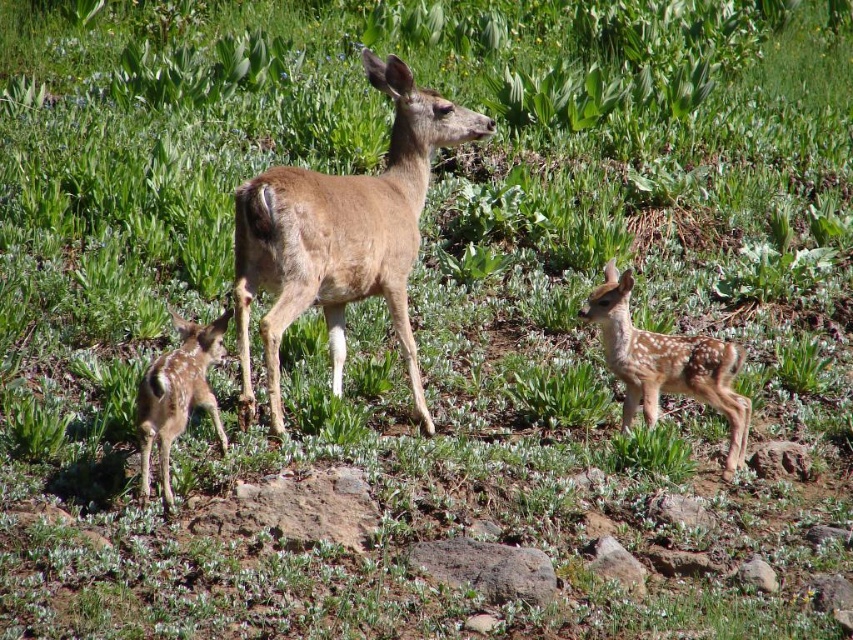
Question: From the image, what is the correct spatial relationship of brown matte deer at center in relation to fawn fur fawn at lower left?

Choices:
 (A) above
 (B) below

Answer: (A)

Question: Which of the following is the farthest from the observer?

Choices:
 (A) (718, 410)
 (B) (165, 483)

Answer: (A)

Question: Among these points, which one is farthest from the camera?

Choices:
 (A) (329, 298)
 (B) (717, 352)

Answer: (B)

Question: Based on their relative distances, which object is nearer to the fawn fur fawn at lower left?

Choices:
 (A) fawn fur fawn at center
 (B) brown matte deer at center

Answer: (B)

Question: Where is brown matte deer at center located in relation to fawn fur fawn at lower left in the image?

Choices:
 (A) right
 (B) left

Answer: (A)

Question: Can you confirm if fawn fur fawn at center is positioned to the left of fawn fur fawn at lower left?

Choices:
 (A) no
 (B) yes

Answer: (A)